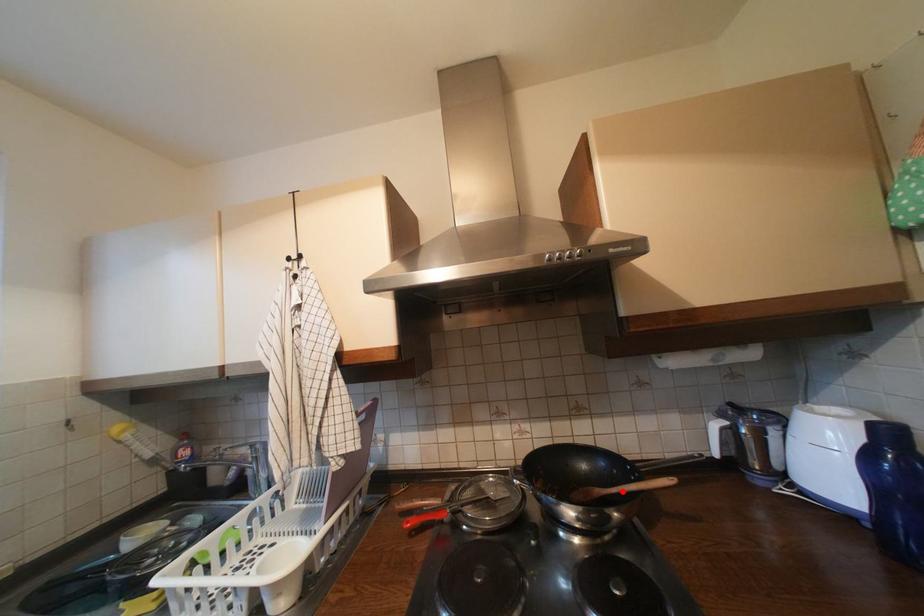
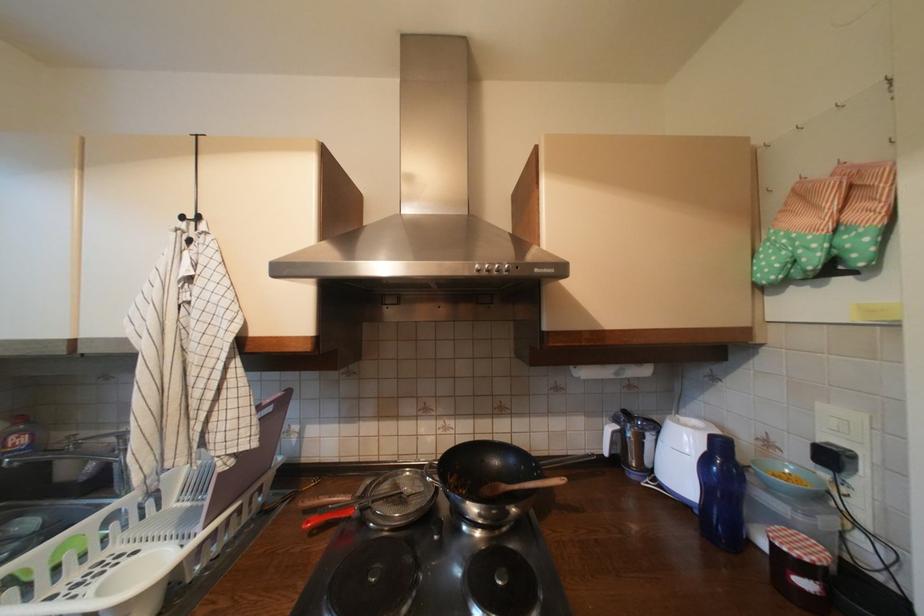
Question: I am providing you with two images of the same scene from different viewpoints. A red point is marked on the first image. At the location where the point appears in image 1, is it still visible in image 2?

Choices:
 (A) Yes
 (B) No

Answer: (A)